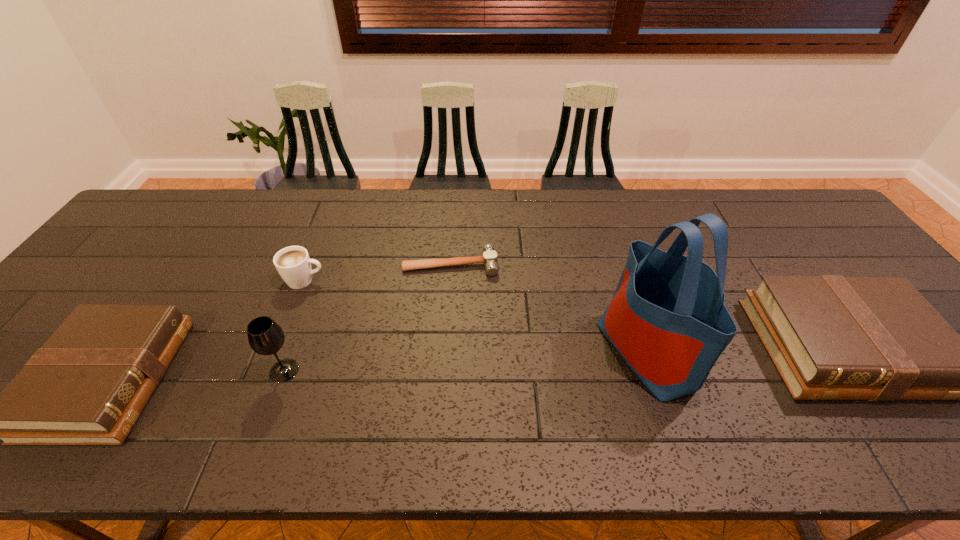
Please point a space for a new Bible to maintain equal intervals. Please provide its 2D coordinates. Your answer should be formatted as a tuple, i.e. [(x, y)], where the tuple contains the x and y coordinates of a point satisfying the conditions above.

[(487, 362)]